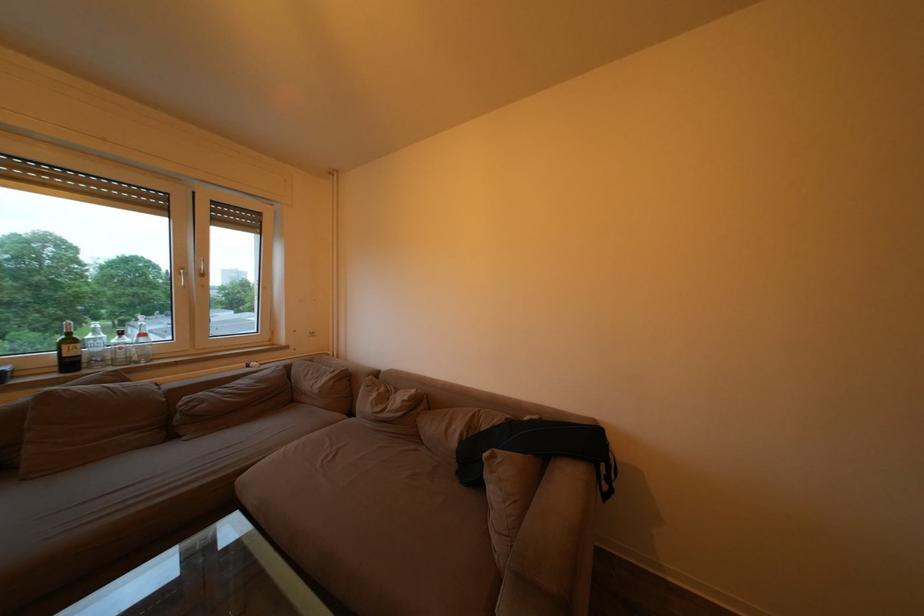
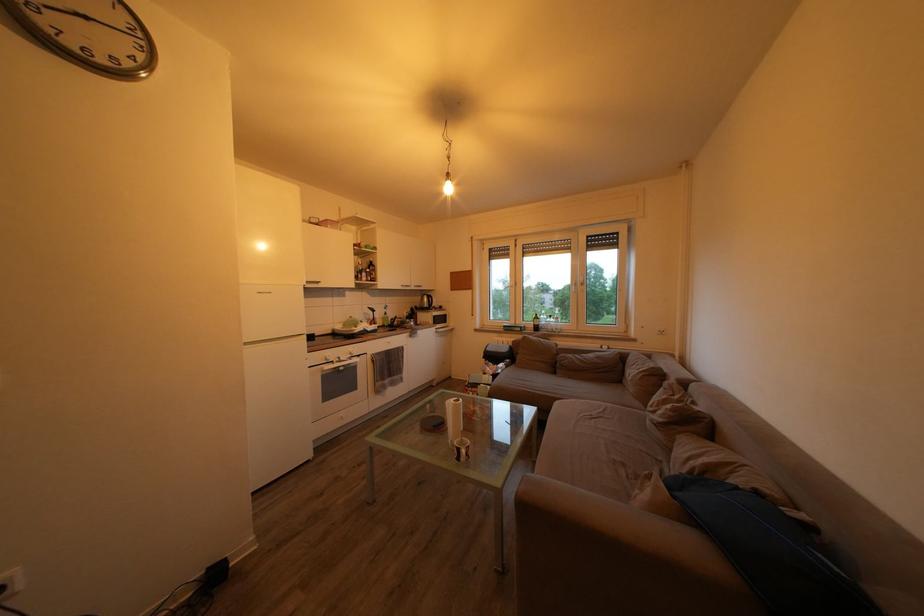
Locate, in the second image, the point that corresponds to the point at 386,416 in the first image.

(659, 416)